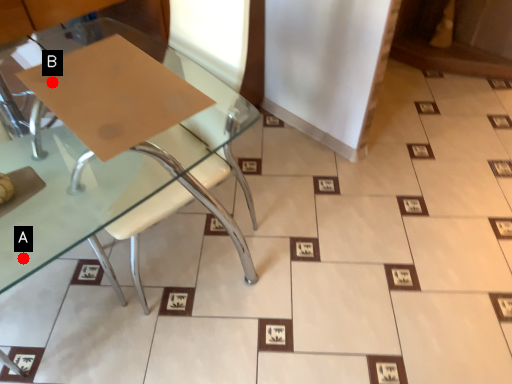
Question: Two points are circled on the image, labeled by A and B beside each circle. Which of the following is the closest to the observer?

Choices:
 (A) A is closer
 (B) B is closer

Answer: (A)